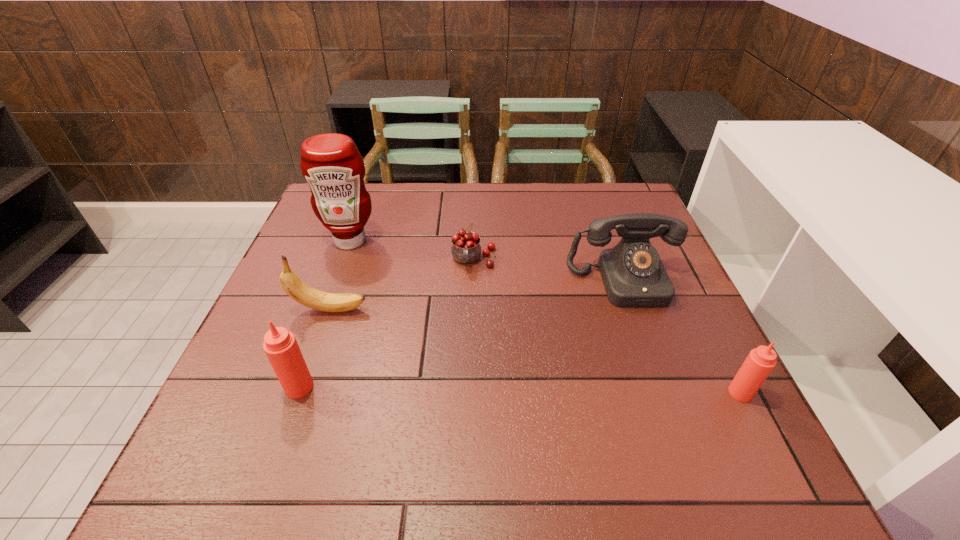
The image size is (960, 540). Find the location of `vacant position for inserting another Tabasco_sauce evenly`. vacant position for inserting another Tabasco_sauce evenly is located at coordinates (518, 390).